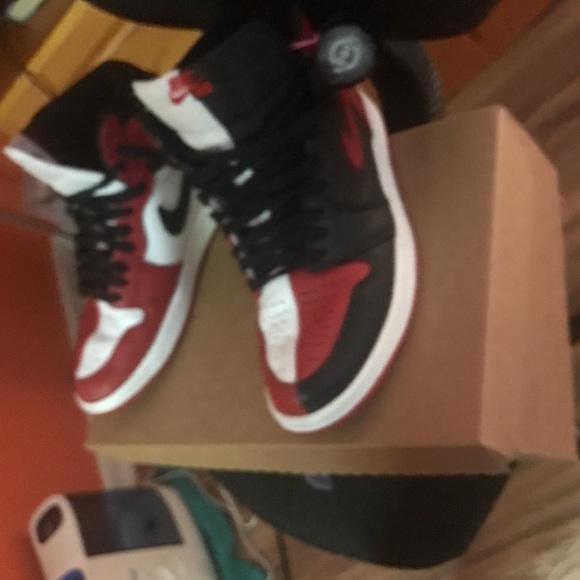
Where is `floor`? The width and height of the screenshot is (580, 580). floor is located at coordinates (534, 499).